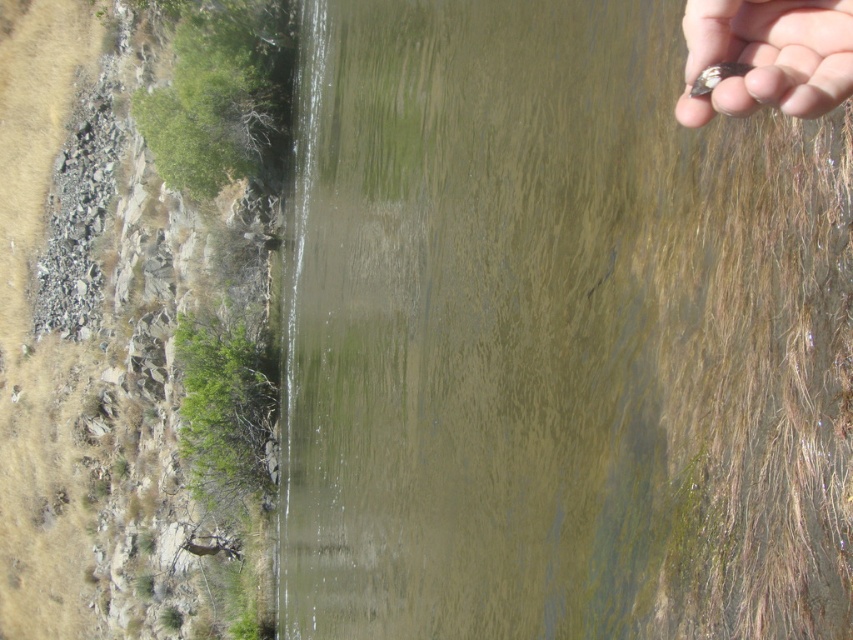
Which is in front, point (764, 520) or point (683, 19)?

Point (764, 520)

Which of these two, greenish murky water at upper center or smooth skin hand at upper right, stands shorter?

smooth skin hand at upper right

Who is more forward, (662, 548) or (828, 90)?

Point (828, 90) is in front.

Where is `greenish murky water at upper center`? This screenshot has width=853, height=640. greenish murky water at upper center is located at coordinates (558, 337).

Who is taller, greenish murky water at upper center or rocks at left?

rocks at left is taller.

Can you confirm if greenish murky water at upper center is taller than rocks at left?

No.

Find the location of a particular element. Image resolution: width=853 pixels, height=640 pixels. greenish murky water at upper center is located at coordinates (558, 337).

The height and width of the screenshot is (640, 853). What do you see at coordinates (91, 337) in the screenshot? I see `rocks at left` at bounding box center [91, 337].

Which is in front, point (83, 211) or point (753, 28)?

Point (753, 28) is in front.

Find the location of a particular element. The image size is (853, 640). rocks at left is located at coordinates (91, 337).